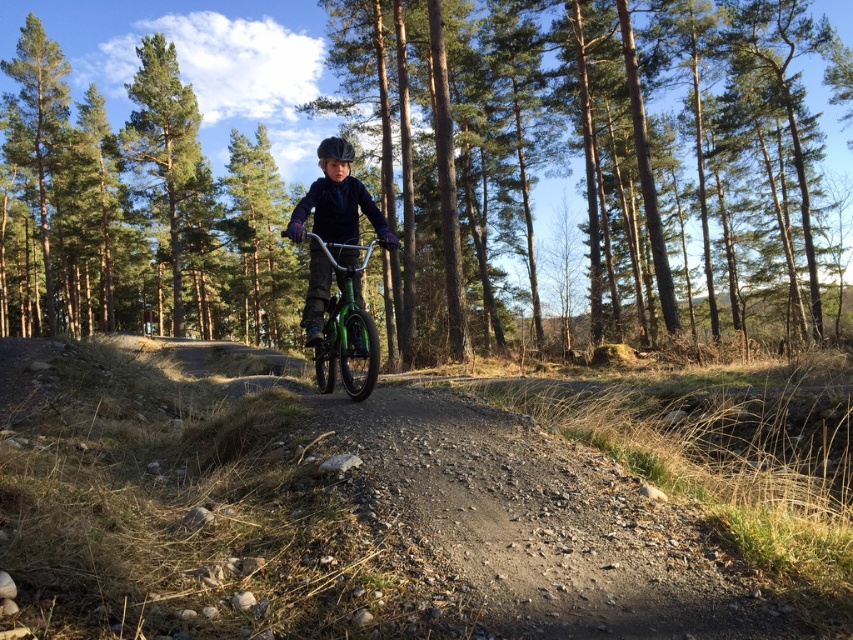
You are a photographer trying to capture the child riding the green metallic bicycle at center and the green metallic mountain bike at center. Since both bikes are in the same location, how can you position yourself to ensure both are visible in the photo?

The green metallic bicycle at center is located above the green metallic mountain bike at center, so positioning yourself at an angle where you can see both the upper and lower positions will ensure both bikes are visible in the photo.

You are standing at the point with coordinates (590, 161). Looking around, you see a green metallic bicycle at center. Which direction should you walk to reach the green metallic bicycle at center?

You are already at the point representing the green metallic bicycle at center, so no need to move.

You are a photographer planning to take a picture of the green metallic bicycle at center and the green matte tree at upper left. Based on their sizes in the image, which object should you focus on first if you want to ensure both are in focus?

The green metallic bicycle at center is larger in size than the green matte tree at upper left. To ensure both are in focus, you should focus on the larger object first, which is the green metallic bicycle at center, as it requires more detailed focus due to its prominence in the frame.